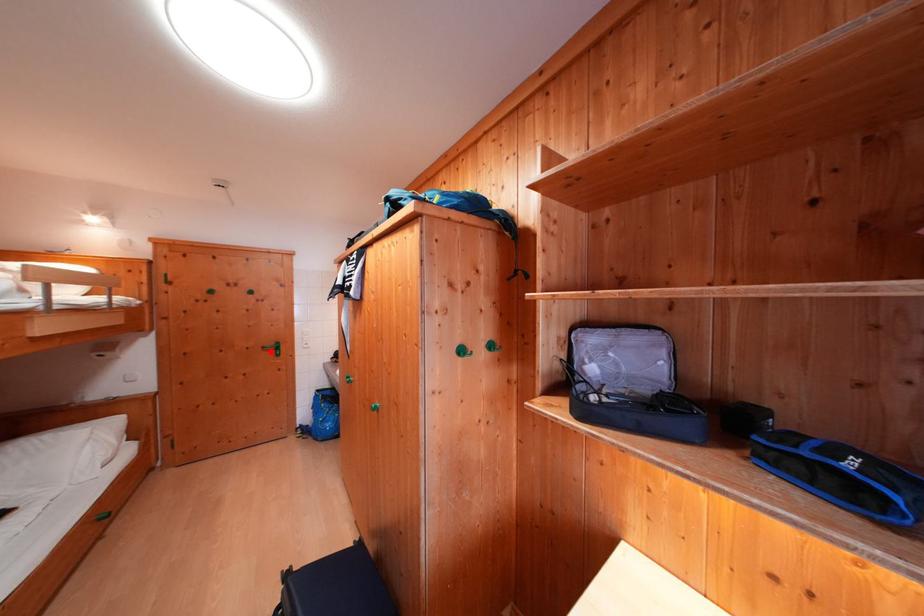
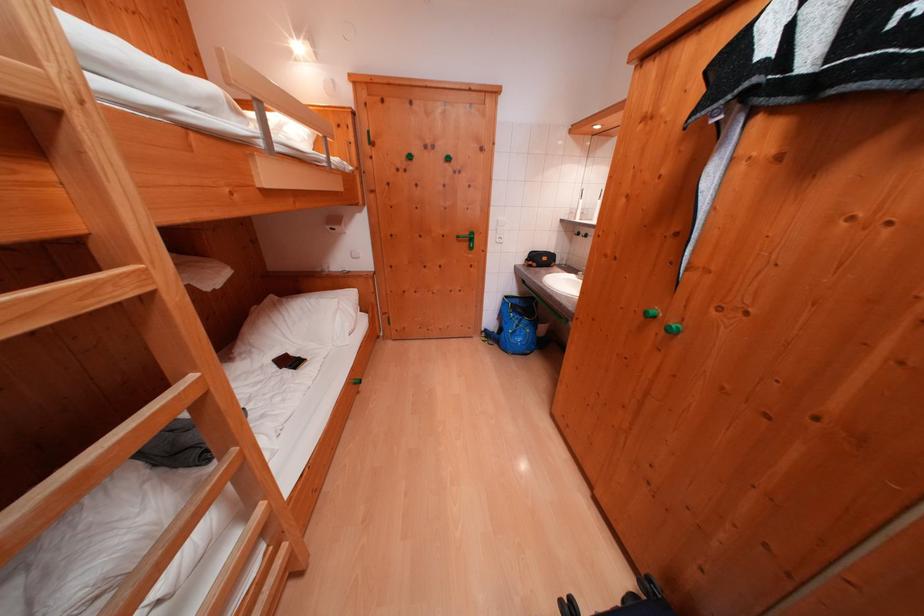
Where in the second image is the point corresponding to the highlighted location from the first image?

(466, 241)